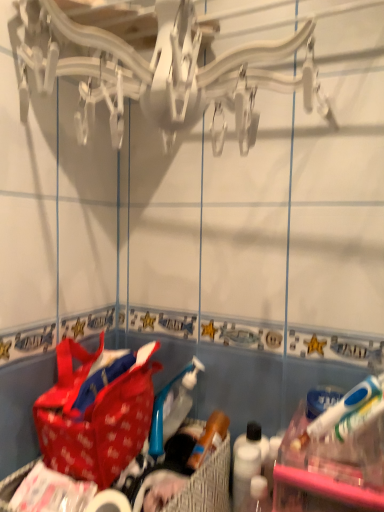
Question: From the image's perspective, is red fabric handbag at lower left under white matte toilet paper at lower center?

Choices:
 (A) no
 (B) yes

Answer: (A)

Question: Does red fabric handbag at lower left have a lesser height compared to white matte toilet paper at lower center?

Choices:
 (A) no
 (B) yes

Answer: (A)

Question: From a real-world perspective, is red fabric handbag at lower left on white matte toilet paper at lower center?

Choices:
 (A) yes
 (B) no

Answer: (A)

Question: Can you confirm if red fabric handbag at lower left is positioned to the right of white matte toilet paper at lower center?

Choices:
 (A) no
 (B) yes

Answer: (A)

Question: Is red fabric handbag at lower left touching white matte toilet paper at lower center?

Choices:
 (A) yes
 (B) no

Answer: (B)

Question: From a real-world perspective, is red fabric handbag at lower left positioned under white matte toilet paper at lower center based on gravity?

Choices:
 (A) no
 (B) yes

Answer: (A)

Question: Would you say white matte toilet paper at lower center contains red fabric picnic basket at lower center?

Choices:
 (A) yes
 (B) no

Answer: (B)

Question: Can you confirm if white matte toilet paper at lower center is bigger than red fabric picnic basket at lower center?

Choices:
 (A) no
 (B) yes

Answer: (A)

Question: From the image's perspective, is white matte toilet paper at lower center below red fabric picnic basket at lower center?

Choices:
 (A) no
 (B) yes

Answer: (A)

Question: Is white matte toilet paper at lower center smaller than red fabric picnic basket at lower center?

Choices:
 (A) no
 (B) yes

Answer: (B)

Question: Is red fabric picnic basket at lower center at the back of white matte toilet paper at lower center?

Choices:
 (A) no
 (B) yes

Answer: (B)

Question: Can you confirm if white matte toilet paper at lower center is shorter than red fabric picnic basket at lower center?

Choices:
 (A) yes
 (B) no

Answer: (A)

Question: Is red fabric picnic basket at lower center taller than red fabric handbag at lower left?

Choices:
 (A) yes
 (B) no

Answer: (B)